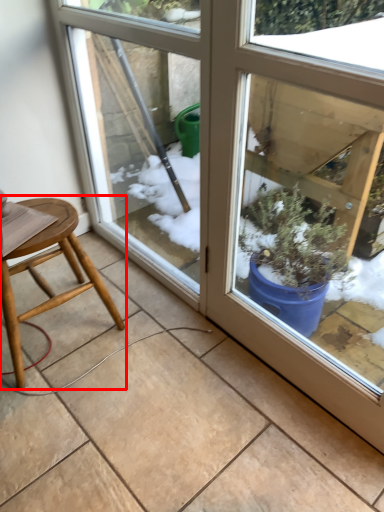
Question: From the image's perspective, where is stool (annotated by the red box) located in relation to screen door in the image?

Choices:
 (A) below
 (B) above

Answer: (A)